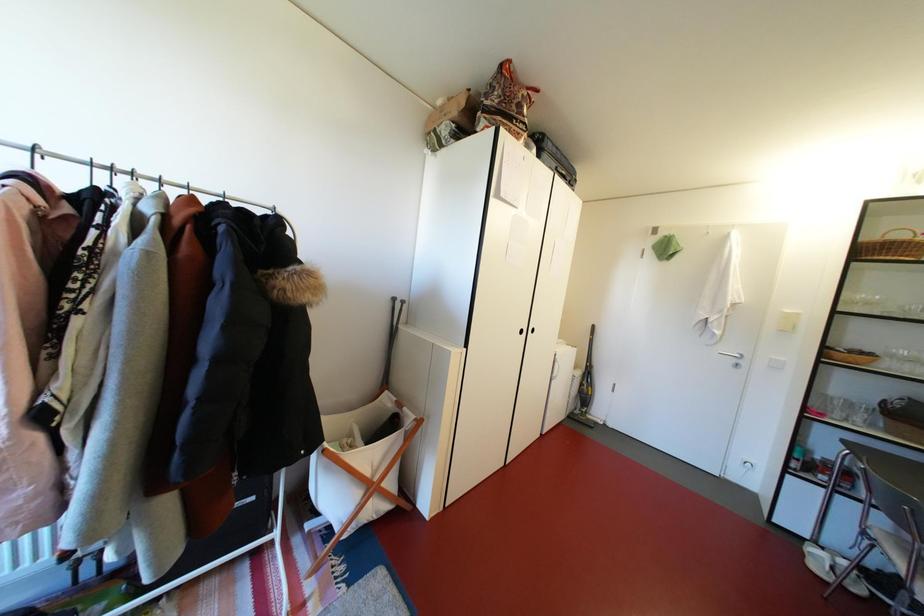
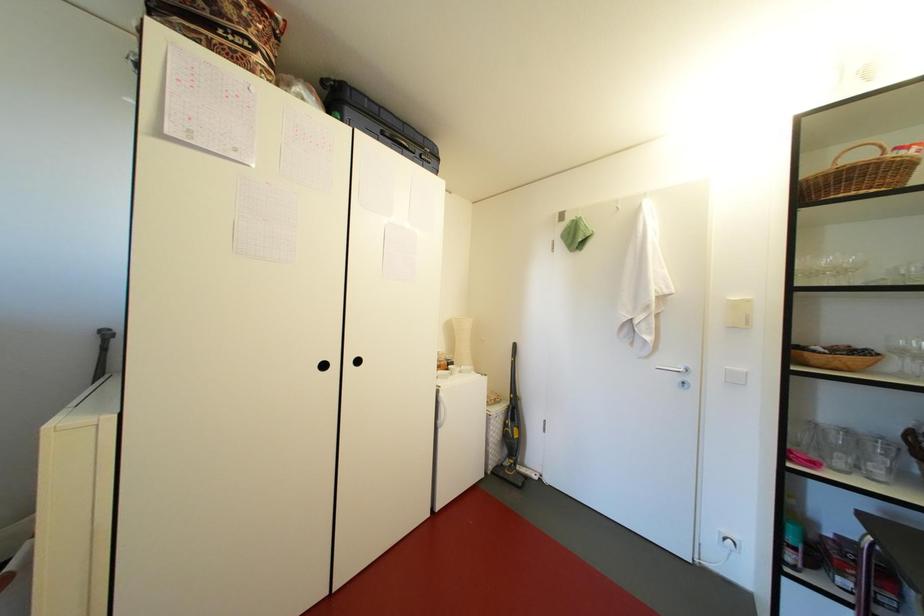
The images are taken continuously from a first-person perspective. In which direction are you moving?

The movement direction of the cameraman is right, forward.